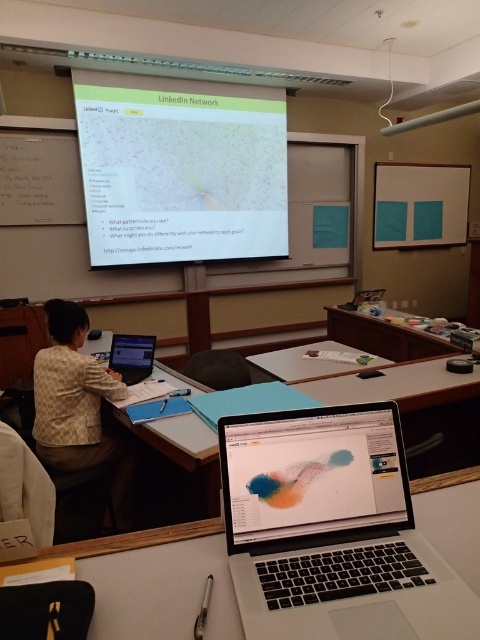
You are a presenter standing at the white plastic table at center. You need to reach the matte black laptop at center to adjust the presentation. Can you comfortably reach it without moving from your current position?

The distance between the white plastic table at center and the matte black laptop at center is 94.35 centimeters. Since this distance is relatively large, you would likely need to move closer to comfortably reach the laptop.